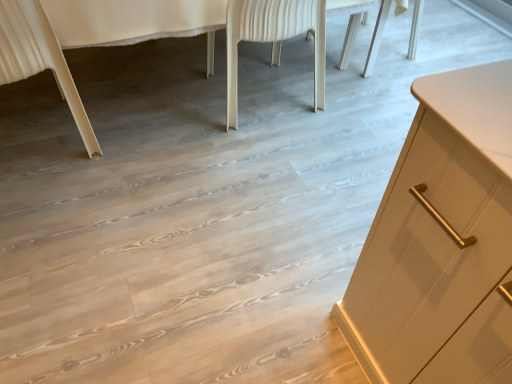
The height and width of the screenshot is (384, 512). In order to click on vacant area that lies in front of light beige wood chair leg at lower left, which is counted as the 2th chair, starting from the right in this screenshot , I will do pos(47,201).